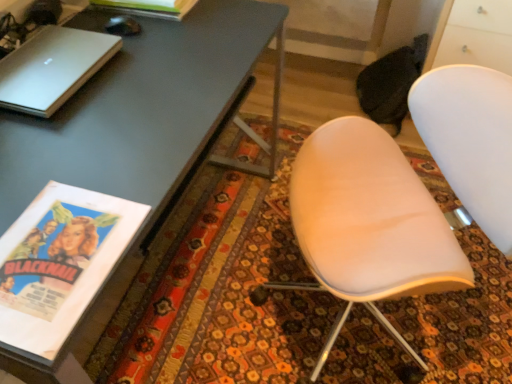
Find the location of a particular element. The image size is (512, 384). empty space that is ontop of matte gray desk at upper left (from a real-world perspective) is located at coordinates (99, 110).